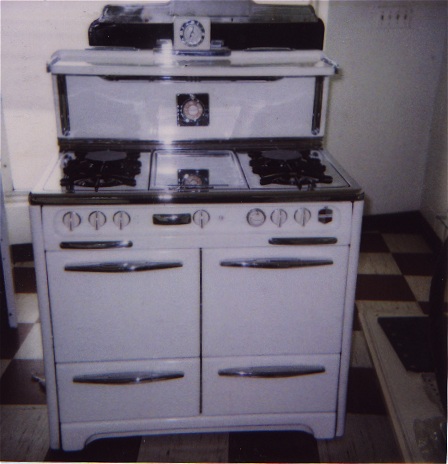
Locate an element on the screen. second light switch is located at coordinates (389, 17).